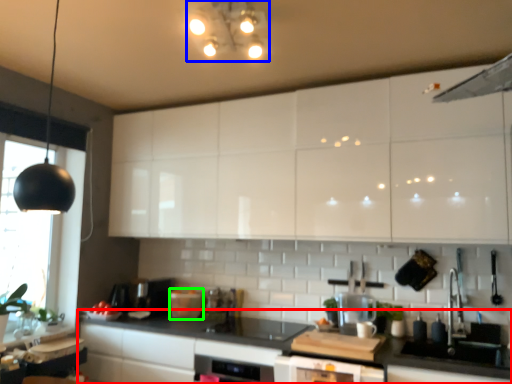
Question: Considering the real-world distances, which object is farthest from countertop (highlighted by a red box)? light fixture (highlighted by a blue box) or appliance (highlighted by a green box)?

Choices:
 (A) light fixture
 (B) appliance

Answer: (A)